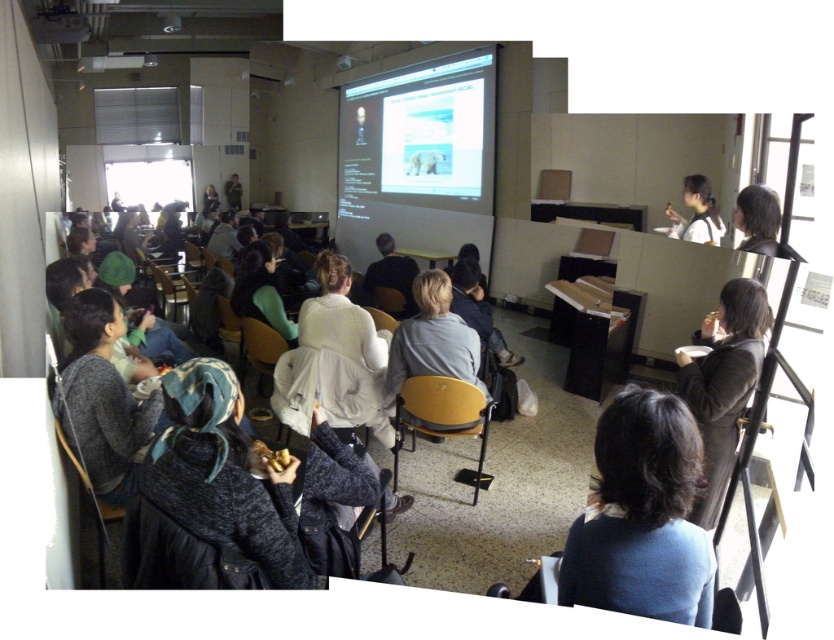
The point at coordinates (418, 154) is located where in the classroom?

The point at coordinates (418, 154) marks the white matte projection screen at center.

In the scene shown: You are standing in the classroom and want to see the projection screen clearly. Where should you position yourself relative to the white matte projection screen at center?

The white matte projection screen at center is located at point 0.242 on the x axis and 0.502 on the y axis, so you should position yourself directly in front of it to ensure a clear view.

You are a student sitting in the classroom and want to see both the white matte projection screen at center and the dark brown leather jacket at right. Which one is higher in the image?

The white matte projection screen at center is located above the dark brown leather jacket at right, so it is higher in the image.